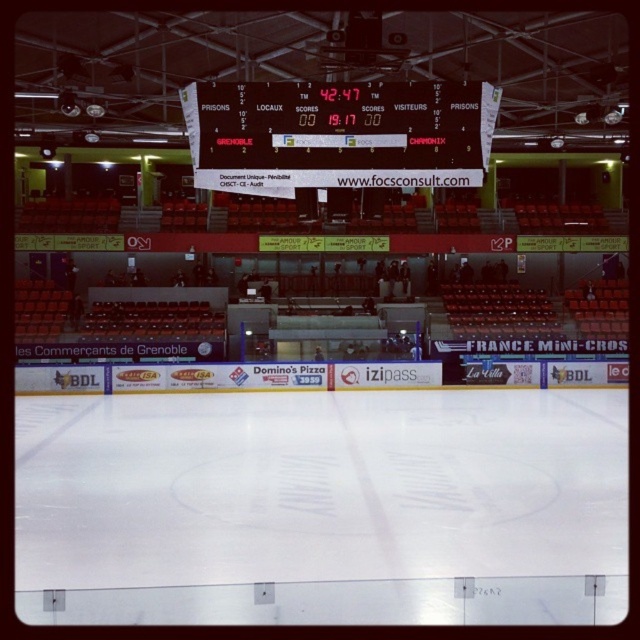
Question: Can you confirm if white smooth ice at center is thinner than wooden scoreboard at center?

Choices:
 (A) no
 (B) yes

Answer: (A)

Question: Does white smooth ice at center appear over wooden scoreboard at center?

Choices:
 (A) no
 (B) yes

Answer: (A)

Question: Which of the following is the closest to the observer?

Choices:
 (A) (253, 161)
 (B) (42, 557)

Answer: (A)

Question: Among these points, which one is nearest to the camera?

Choices:
 (A) (362, 161)
 (B) (346, 552)

Answer: (A)

Question: Can you confirm if white smooth ice at center is bigger than wooden scoreboard at center?

Choices:
 (A) yes
 (B) no

Answer: (A)